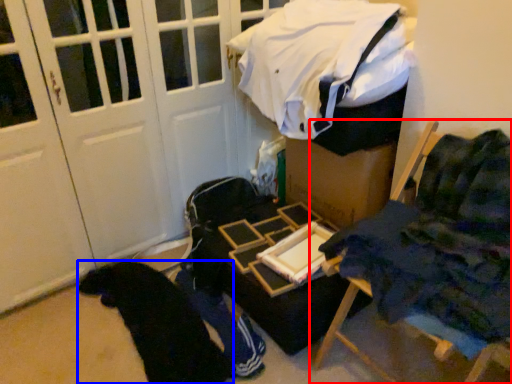
Question: Which object is further to the camera taking this photo, furniture (highlighted by a red box) or clothing (highlighted by a blue box)?

Choices:
 (A) furniture
 (B) clothing

Answer: (B)